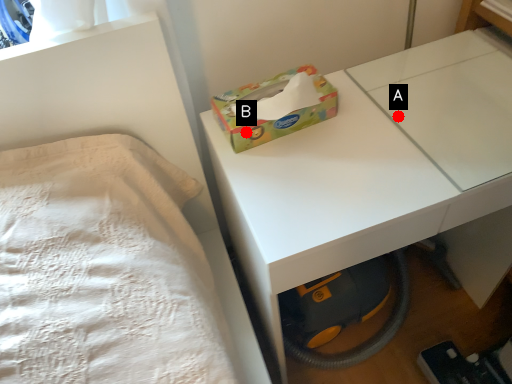
Question: Two points are circled on the image, labeled by A and B beside each circle. Which of the following is the farthest from the observer?

Choices:
 (A) A is further
 (B) B is further

Answer: (A)